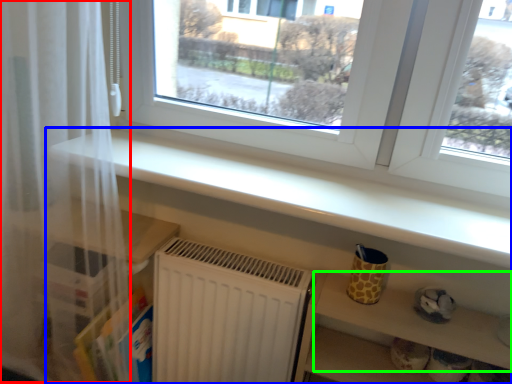
Question: Which object is the closest to the curtain (highlighted by a red box)? Choose among these: shelf (highlighted by a blue box) or shelf (highlighted by a green box).

Choices:
 (A) shelf
 (B) shelf

Answer: (A)